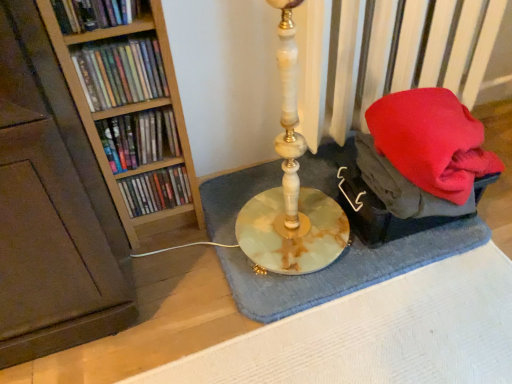
Locate an element on the screen. Image resolution: width=512 pixels, height=384 pixels. empty space that is ontop of blue textured bath mat at center is located at coordinates (302, 222).